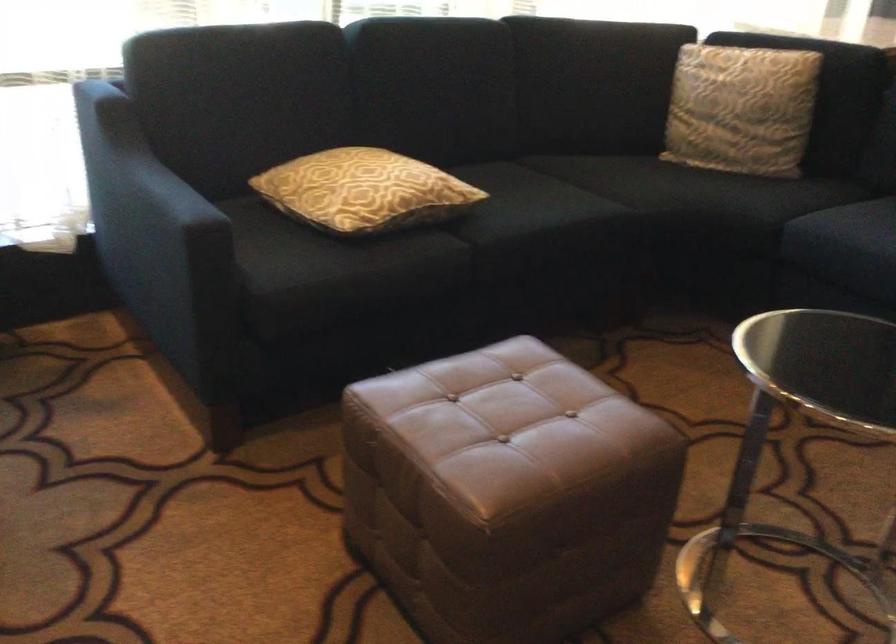
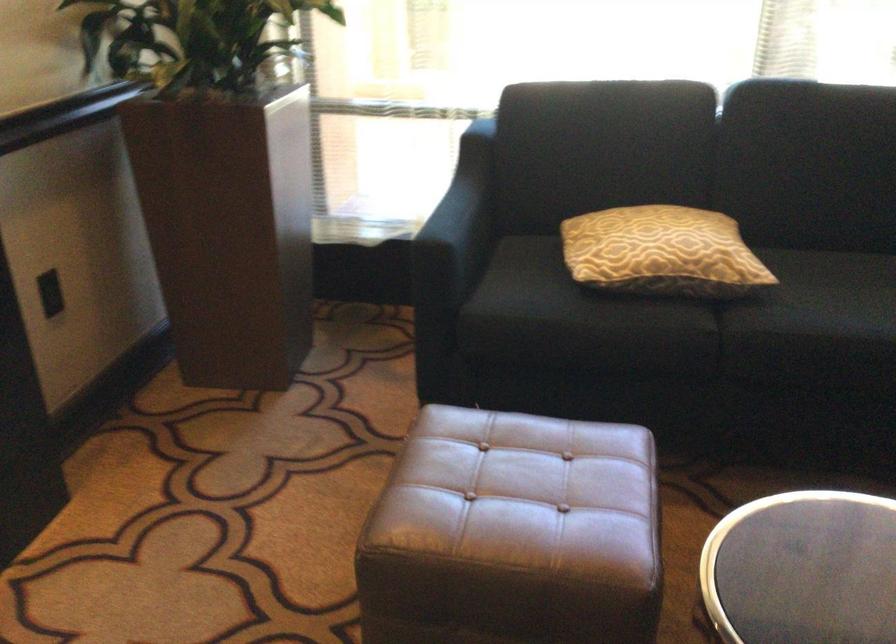
Find the pixel in the second image that matches point (531, 419) in the first image.

(522, 495)